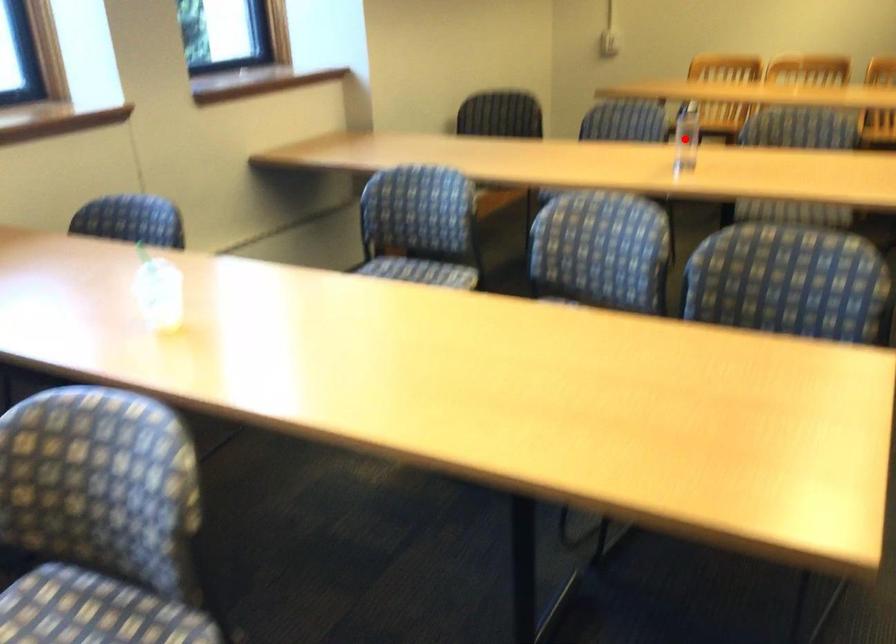
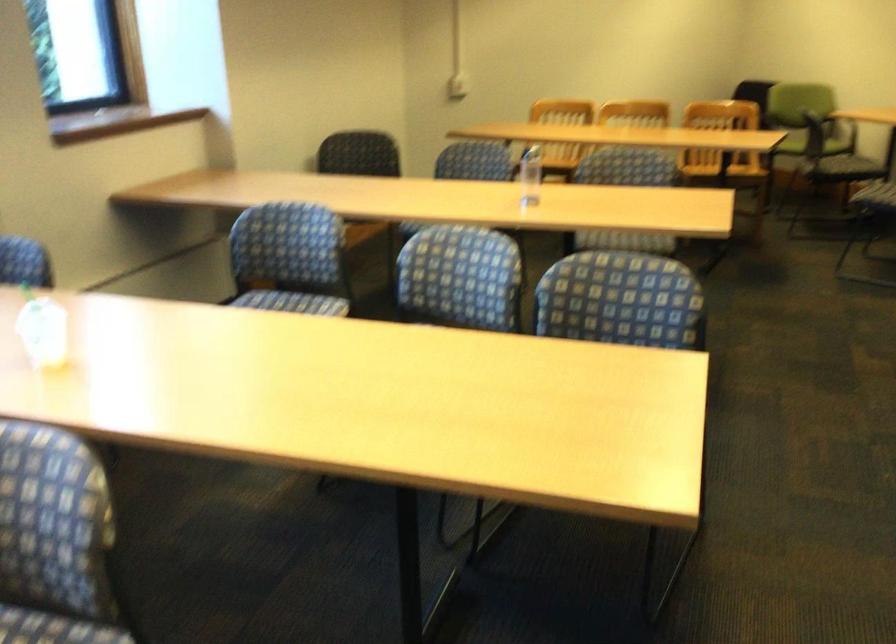
Where in the second image is the point corresponding to the highlighted location from the first image?

(530, 176)